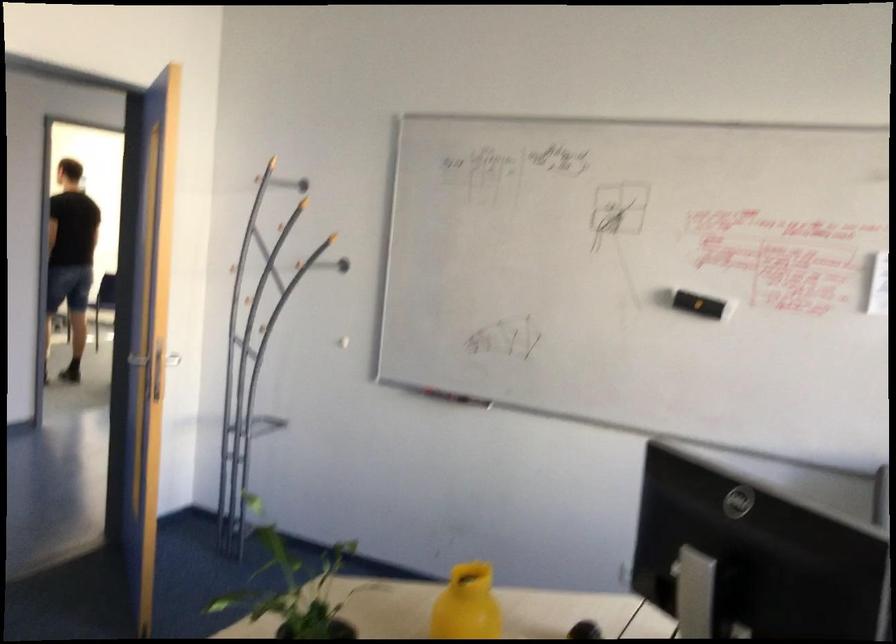
Find where to turn the metal door handle. Please return your answer as a coordinate pair (x, y).

(181, 371)